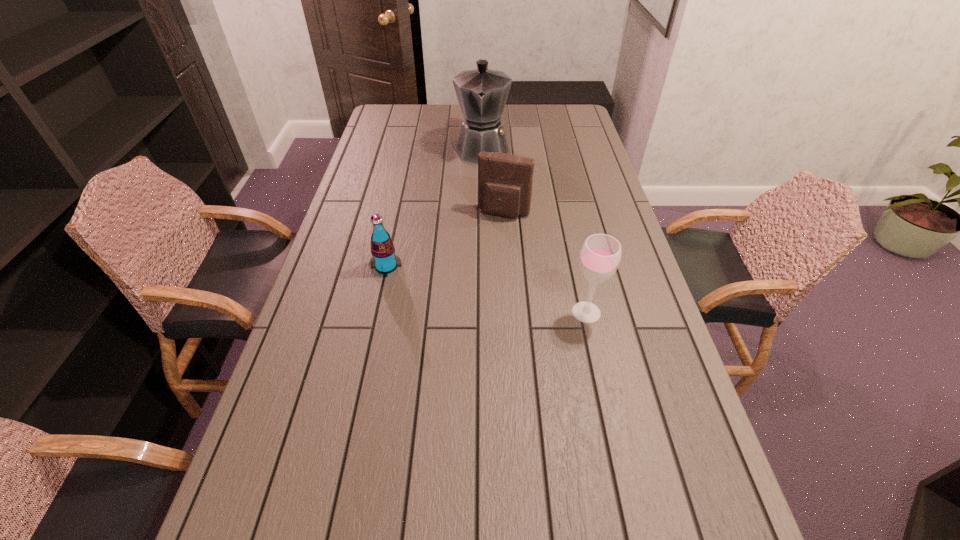
Find the location of a particular element. This screenshot has height=540, width=960. vacant region between the coffeepot and the rightmost object is located at coordinates (534, 230).

Where is `empty space between the soda and the third nearest object`? This screenshot has height=540, width=960. empty space between the soda and the third nearest object is located at coordinates [445, 240].

Locate which object ranks in proximity to the coffeepot. Please provide its 2D coordinates. Your answer should be formatted as a tuple, i.e. [(x, y)], where the tuple contains the x and y coordinates of a point satisfying the conditions above.

[(505, 181)]

Image resolution: width=960 pixels, height=540 pixels. Identify the location of object that stands as the closest to the tallest object. (505, 181).

This screenshot has width=960, height=540. In order to click on free space that satisfies the following two spatial constraints: 1. on the front side of the nearest object; 2. on the right side of the coffeepot in this screenshot , I will do `click(483, 312)`.

This screenshot has height=540, width=960. Find the location of `vacant position in the image that satisfies the following two spatial constraints: 1. on the front side of the coffeepot; 2. on the left side of the second farthest object`. vacant position in the image that satisfies the following two spatial constraints: 1. on the front side of the coffeepot; 2. on the left side of the second farthest object is located at coordinates click(482, 213).